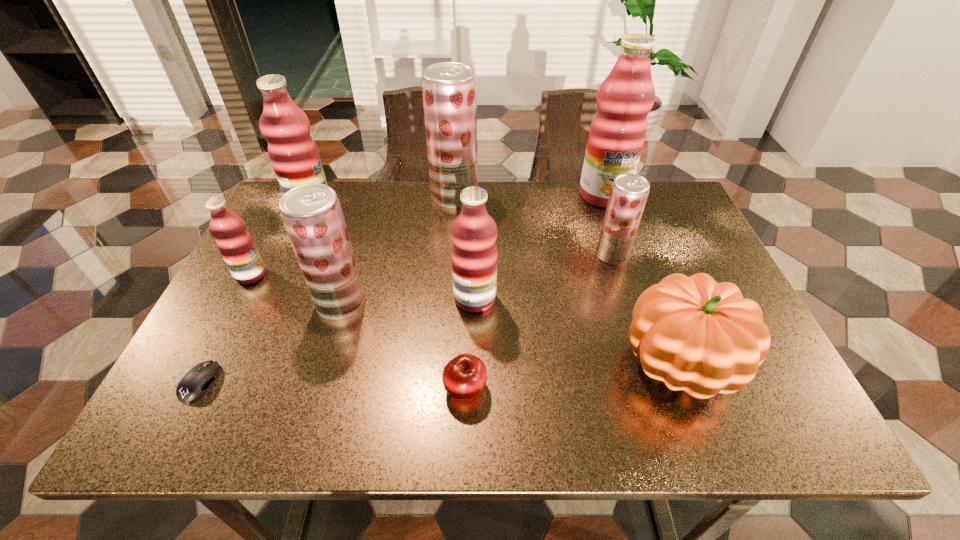
Identify the location of fruit juice that is at the right edge. The width and height of the screenshot is (960, 540). (618, 129).

The image size is (960, 540). I want to click on pumpkin at the right edge, so click(696, 335).

Find the location of a particular element. This screenshot has width=960, height=540. object that is at the far left corner is located at coordinates (294, 155).

You are a GUI agent. You are given a task and a screenshot of the screen. Output one action in this format:
    pyautogui.click(x=<x>, y=<y>)
    Task: Click on the object present at the near left corner
    
    Given the screenshot: What is the action you would take?
    pyautogui.click(x=195, y=382)

At what (x,y) coordinates should I click in order to perform the action: click on object at the far right corner. Please return your answer as a coordinate pair (x, y). Image resolution: width=960 pixels, height=540 pixels. Looking at the image, I should click on (618, 129).

The image size is (960, 540). Identify the location of object positioned at the near right corner. (696, 335).

Where is `free space at the far edge`? free space at the far edge is located at coordinates (362, 201).

In the image, there is a desktop. Identify the location of vacant space at the near edge. The image size is (960, 540). (414, 401).

In the image, there is a desktop. In order to click on vacant space at the right edge in this screenshot , I will do `click(702, 268)`.

The width and height of the screenshot is (960, 540). I want to click on free space at the far left corner of the desktop, so click(278, 230).